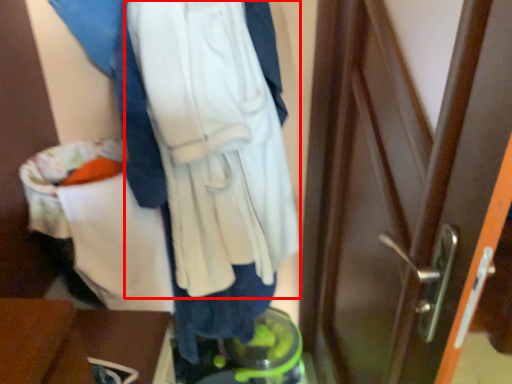
Question: From the image's perspective, what is the correct spatial relationship of sweatshirt (annotated by the red box) in relation to furniture?

Choices:
 (A) below
 (B) above

Answer: (B)